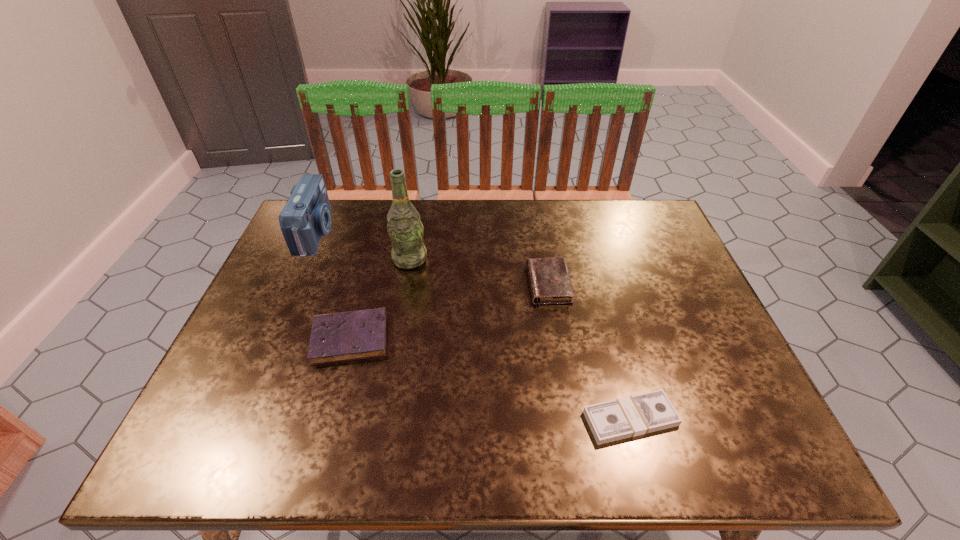
Locate an element on the screen. the tallest object is located at coordinates (405, 229).

I want to click on the second tallest object, so click(306, 216).

You are a GUI agent. You are given a task and a screenshot of the screen. Output one action in this format:
    pyautogui.click(x=<x>, y=<y>)
    Task: Click on the leftmost object
    Image resolution: width=960 pixels, height=540 pixels.
    Given the screenshot: What is the action you would take?
    pyautogui.click(x=306, y=216)

I want to click on the right diary, so click(x=549, y=279).

Identify the location of the shorter diary. This screenshot has height=540, width=960. (354, 335).

Locate an element on the screen. the left diary is located at coordinates (354, 335).

Identify the location of the nearest object. Image resolution: width=960 pixels, height=540 pixels. (631, 416).

In order to click on dollar in this screenshot , I will do `click(631, 416)`.

This screenshot has width=960, height=540. Find the location of `vacant space situated on the surface of the beer bottle`. vacant space situated on the surface of the beer bottle is located at coordinates (395, 343).

The width and height of the screenshot is (960, 540). Find the location of `vacant region located on the lens of the second tallest object`. vacant region located on the lens of the second tallest object is located at coordinates (374, 233).